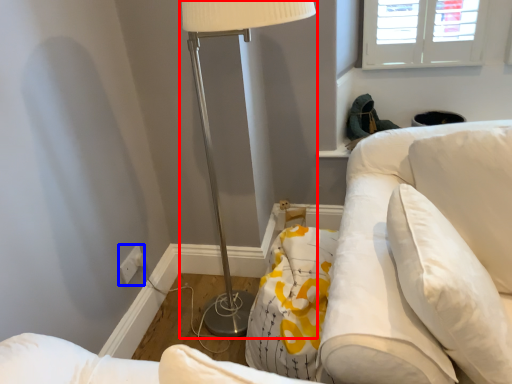
Question: Among these objects, which one is nearest to the camera, lamp (highlighted by a red box) or electric outlet (highlighted by a blue box)?

Choices:
 (A) lamp
 (B) electric outlet

Answer: (A)